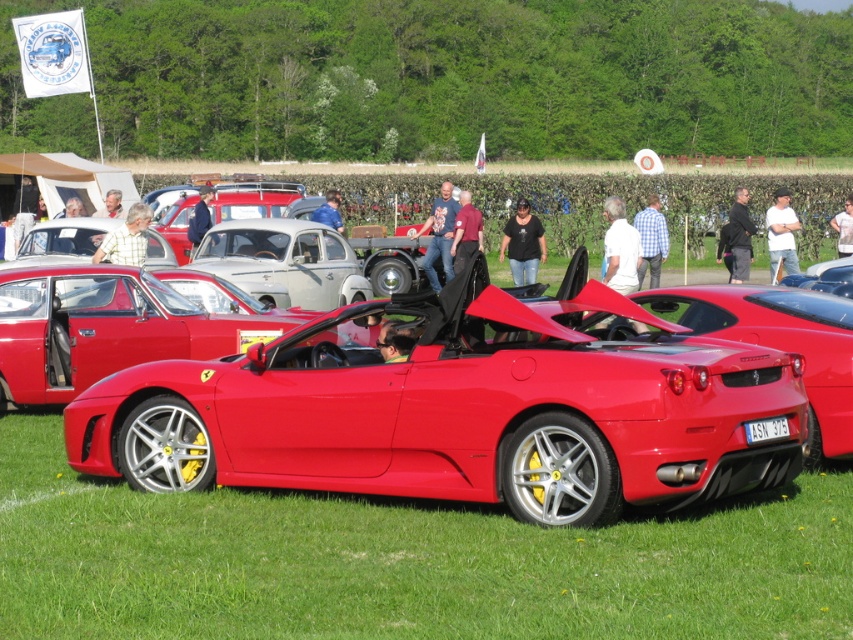
Question: Which object is positioned farthest from the glossy red convertible at center?

Choices:
 (A) shiny red sports car at center
 (B) green grass at lower center

Answer: (B)

Question: Which point is farther from the camera taking this photo?

Choices:
 (A) (77, 300)
 (B) (840, 481)

Answer: (A)

Question: Is shiny red sports car at center below green grass at lower center?

Choices:
 (A) yes
 (B) no

Answer: (B)

Question: Is green grass at lower center positioned in front of glossy red convertible at center?

Choices:
 (A) no
 (B) yes

Answer: (B)

Question: Which object is positioned farthest from the shiny red sports car at center?

Choices:
 (A) green grass at lower center
 (B) glossy red convertible at center

Answer: (B)

Question: Is the position of shiny red sports car at center more distant than that of green grass at lower center?

Choices:
 (A) yes
 (B) no

Answer: (A)